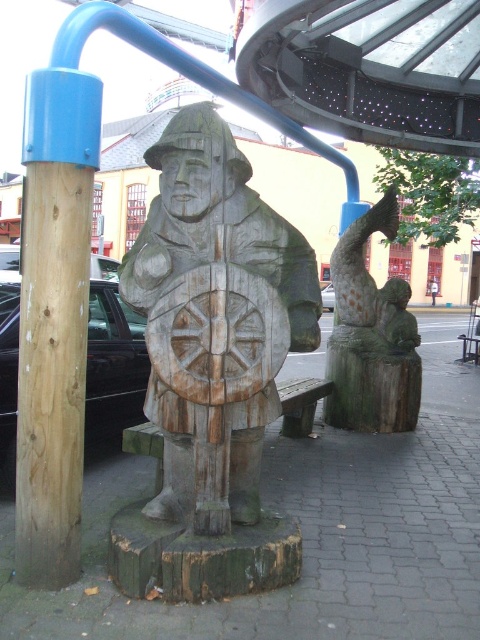
Based on the photo, you are an art curator examining the wooden sculpture. You notice two points marked on the sculpture. The first point is at coordinates point [28,474] and the second is at point [367,364]. From your vantage point, which of these points is closer to you?

Point [28,474] is in front of point [367,364], so it is closer to you.

You are an art curator planning to install a spotlight on the natural wood post at left. The spotlight can only illuminate objects within a 0.1 radius from its center point. If you place the spotlight exactly at point (x=54, y=321), will it effectively light up the natural wood post at left?

The natural wood post at left is located at point (x=54, y=321), so placing the spotlight exactly at that point will ensure it is within the 0.1 radius, effectively lighting up the natural wood post at left.